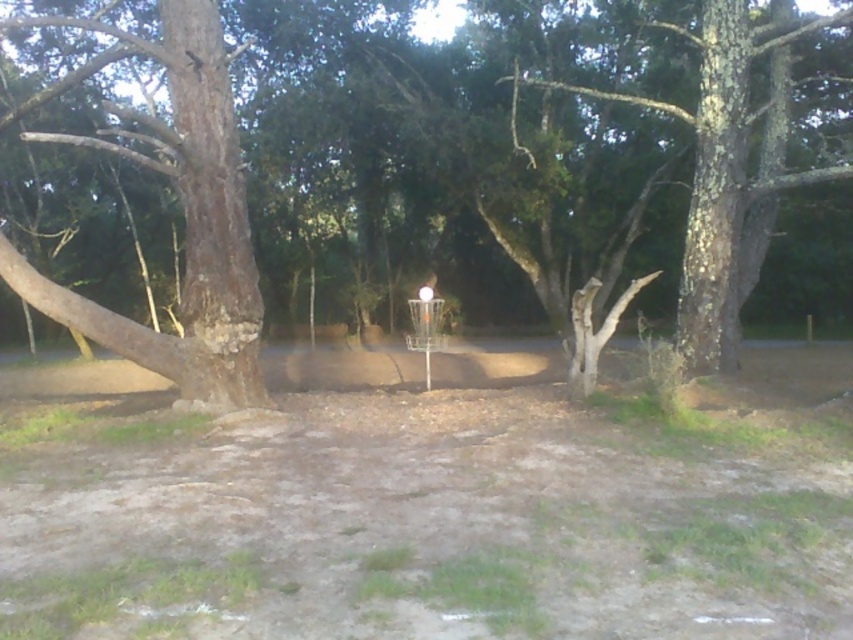
Question: Which point is farther to the camera?

Choices:
 (A) (738, 60)
 (B) (207, 170)
 (C) (720, 301)

Answer: (C)

Question: Is rough bark tree at left above rough bark tree at center?

Choices:
 (A) yes
 (B) no

Answer: (B)

Question: Which of the following is the closest to the observer?

Choices:
 (A) rough bark tree at center
 (B) rough bark tree at left
 (C) brown rough tree at center

Answer: (B)

Question: Estimate the real-world distances between objects in this image. Which object is closer to the brown rough tree at center?

Choices:
 (A) rough bark tree at center
 (B) rough bark tree at left

Answer: (A)

Question: Can you confirm if rough bark tree at left is positioned below rough bark tree at center?

Choices:
 (A) yes
 (B) no

Answer: (A)

Question: Observing the image, what is the correct spatial positioning of brown rough tree at center in reference to rough bark tree at center?

Choices:
 (A) left
 (B) right

Answer: (B)